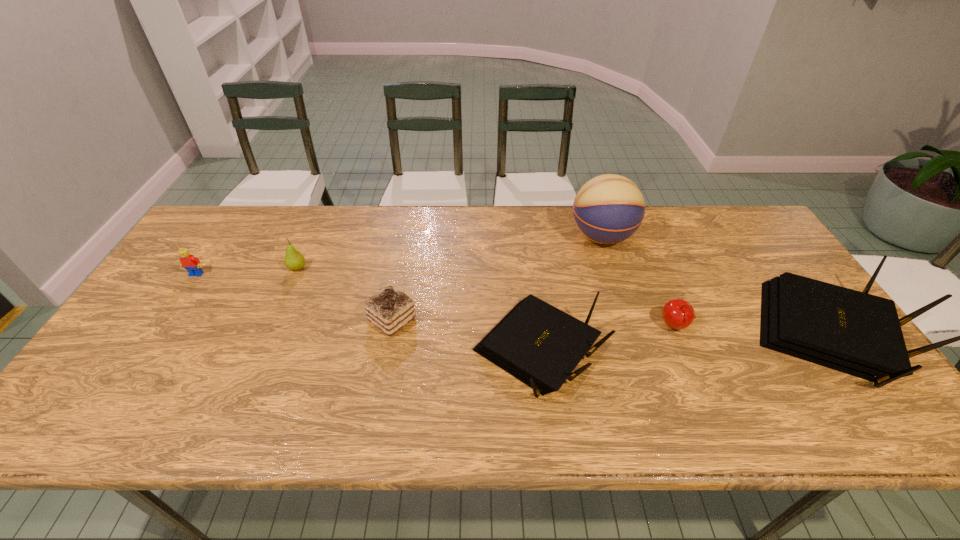
Find the location of a particular element. Image resolution: width=960 pixels, height=540 pixels. the left router is located at coordinates (540, 345).

Where is `the shorter router`? the shorter router is located at coordinates (540, 345).

You are a GUI agent. You are given a task and a screenshot of the screen. Output one action in this format:
    pyautogui.click(x=<x>, y=<y>)
    Task: Click on the pear
    
    Given the screenshot: What is the action you would take?
    pyautogui.click(x=294, y=260)

The width and height of the screenshot is (960, 540). Find the location of `basketball`. basketball is located at coordinates (609, 208).

Find the location of a particular element. the farthest object is located at coordinates (609, 208).

At what (x,y) coordinates should I click in order to perform the action: click on Lego. Please return your answer as a coordinate pair (x, y). Looking at the image, I should click on (192, 264).

You are a GUI agent. You are given a task and a screenshot of the screen. Output one action in this format:
    pyautogui.click(x=<x>, y=<y>)
    Task: Click on the third object from left to right
    This screenshot has height=540, width=960.
    Given the screenshot: What is the action you would take?
    pyautogui.click(x=390, y=309)

Where is `cherry`? This screenshot has width=960, height=540. cherry is located at coordinates (678, 314).

Find the location of a particular element. The width and height of the screenshot is (960, 540). free space located on the back of the left router is located at coordinates (529, 286).

Where is `vacant space situated 0.160m on the front of the sixth object from right to left`? vacant space situated 0.160m on the front of the sixth object from right to left is located at coordinates (276, 315).